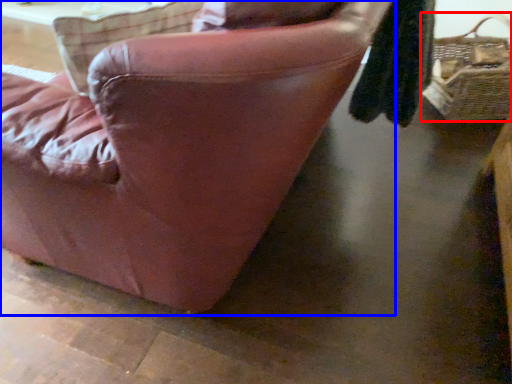
Question: Which object appears farthest to the camera in this image, picnic basket (highlighted by a red box) or chair (highlighted by a blue box)?

Choices:
 (A) picnic basket
 (B) chair

Answer: (A)